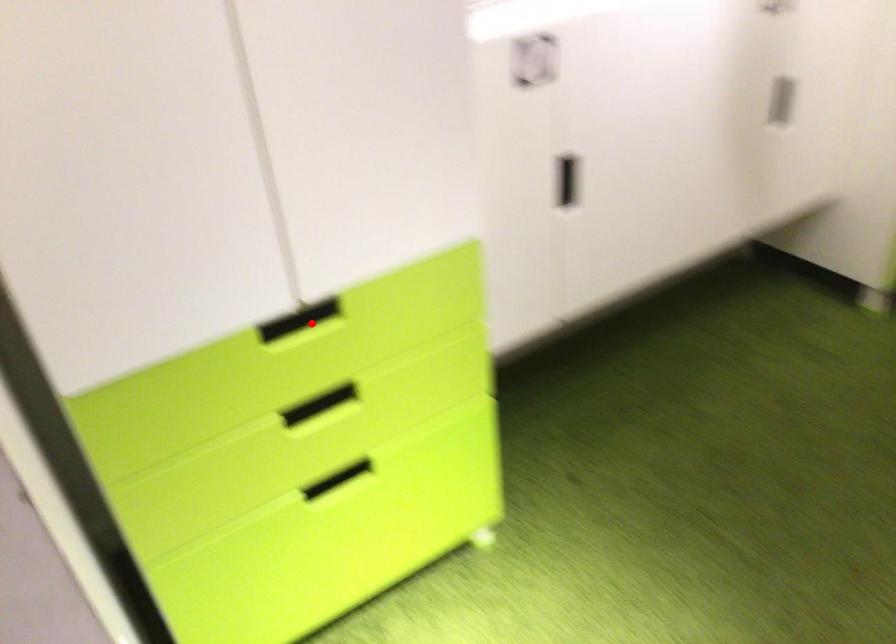
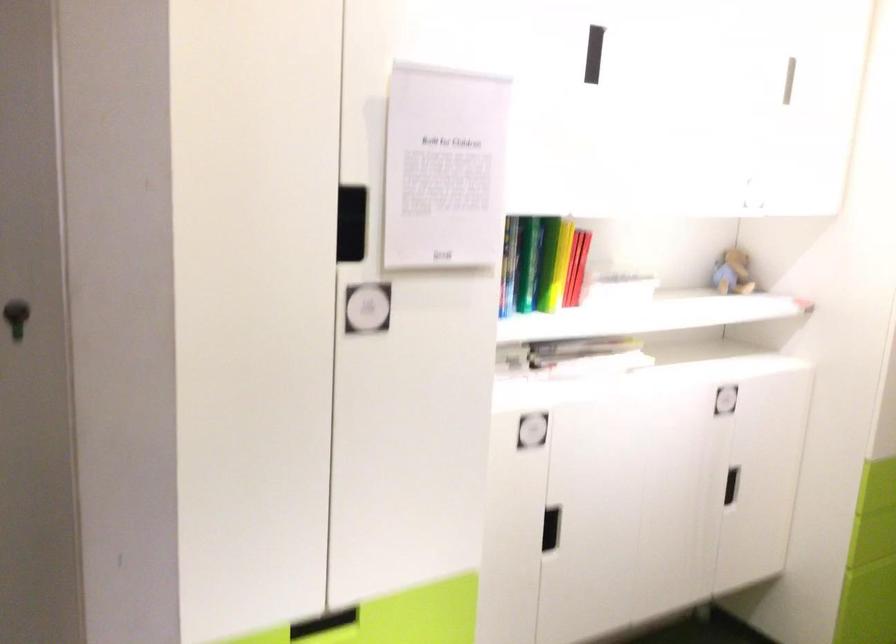
Question: I am providing you with two images of the same scene from different viewpoints. Given a red point in image1, look at the same physical point in image2. Is it:

Choices:
 (A) Closer to the viewpoint
 (B) Farther from the viewpoint

Answer: (B)